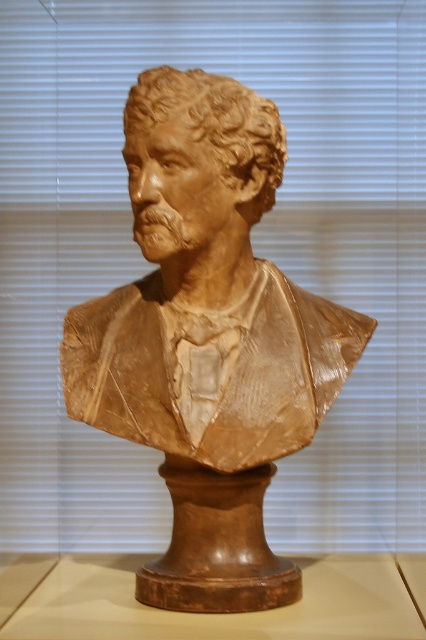
Question: Where is matte brown bust at center located in relation to brown clay bust at center in the image?

Choices:
 (A) above
 (B) below

Answer: (B)

Question: Does matte brown bust at center have a larger size compared to brown clay bust at center?

Choices:
 (A) no
 (B) yes

Answer: (B)

Question: Can you confirm if matte brown bust at center is positioned below brown clay bust at center?

Choices:
 (A) no
 (B) yes

Answer: (B)

Question: Which point is closer to the camera?

Choices:
 (A) (173, 467)
 (B) (230, 172)

Answer: (B)